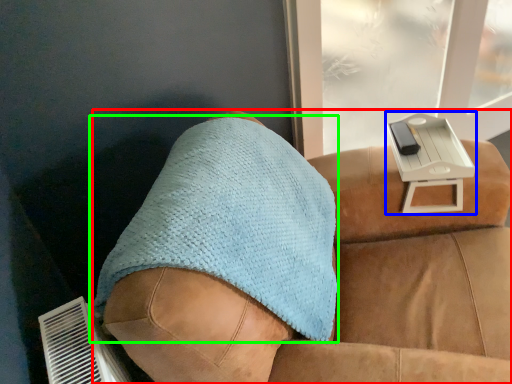
Question: Based on their relative distances, which object is nearer to furniture (highlighted by a red box)? Choose from table (highlighted by a blue box) and throw pillow (highlighted by a green box).

Choices:
 (A) table
 (B) throw pillow

Answer: (B)